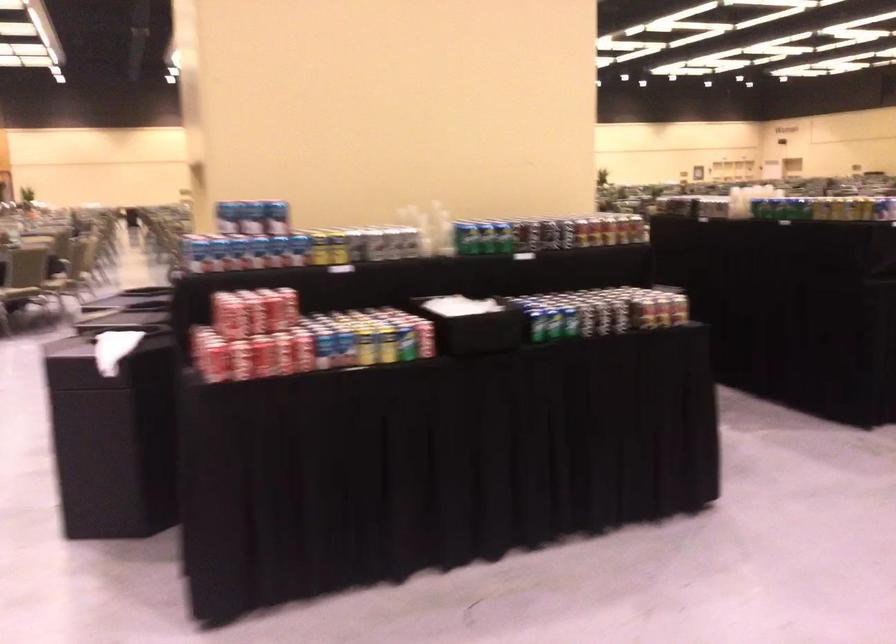
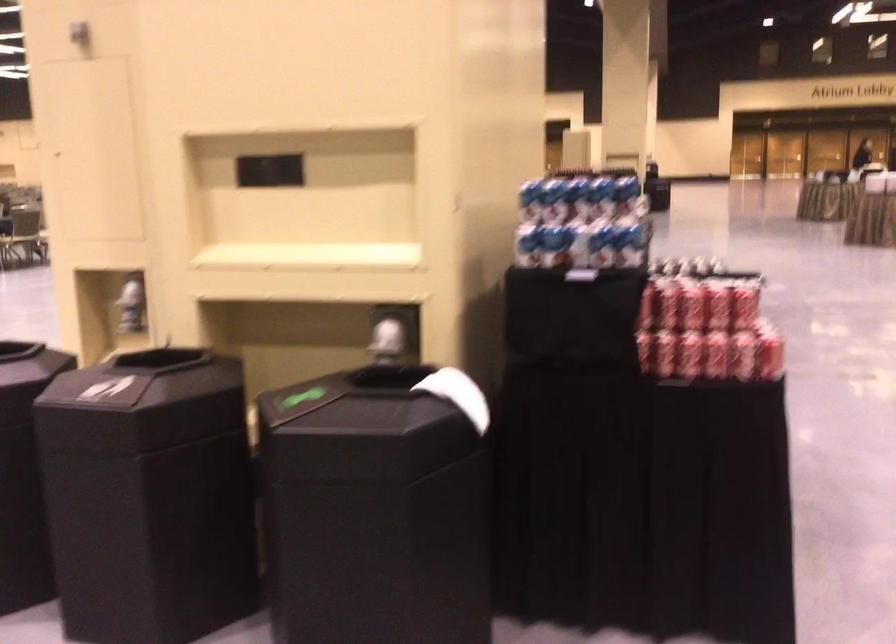
Find the pixel in the second image that matches the point at 187,247 in the first image.

(528, 245)